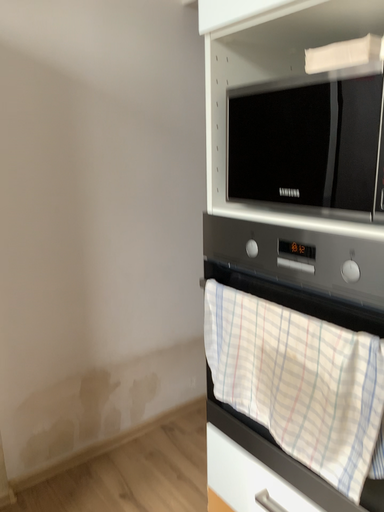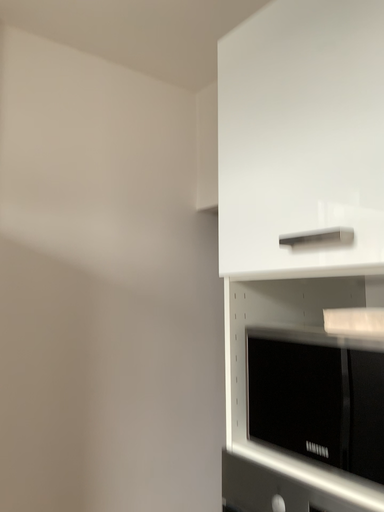
Question: Which way did the camera rotate in the video?

Choices:
 (A) rotated downward
 (B) rotated upward

Answer: (B)